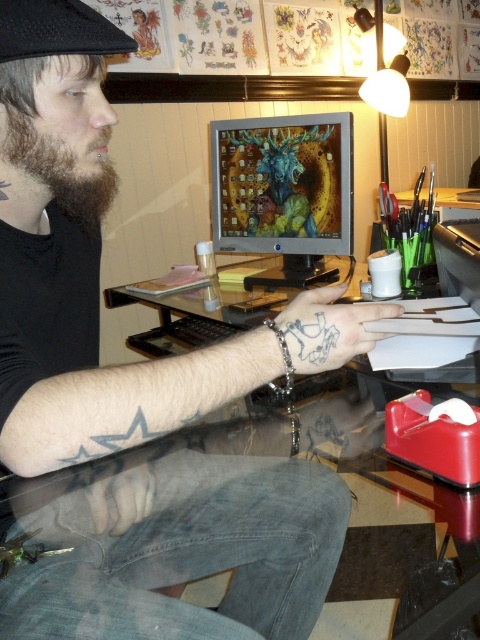
Question: Estimate the real-world distances between objects in this image. Which object is closer to the matte plastic monitor at center?

Choices:
 (A) brown fuzzy beard at left
 (B) transparent glass desk at center
 (C) black fabric baseball hat at upper left

Answer: (B)

Question: Which of the following is the farthest from the observer?

Choices:
 (A) (192, 365)
 (B) (331, 362)
 (C) (21, 49)

Answer: (B)

Question: Is transparent glass desk at center above blue ink tattoo at upper center?

Choices:
 (A) no
 (B) yes

Answer: (A)

Question: Which object appears closest to the camera in this image?

Choices:
 (A) matte plastic monitor at center
 (B) transparent glass desk at center
 (C) black fabric baseball hat at upper left

Answer: (C)

Question: Does black skin tattoo at center come in front of matte plastic monitor at center?

Choices:
 (A) yes
 (B) no

Answer: (A)

Question: Where is transparent glass desk at center located in relation to black fabric baseball hat at upper left in the image?

Choices:
 (A) below
 (B) above

Answer: (A)